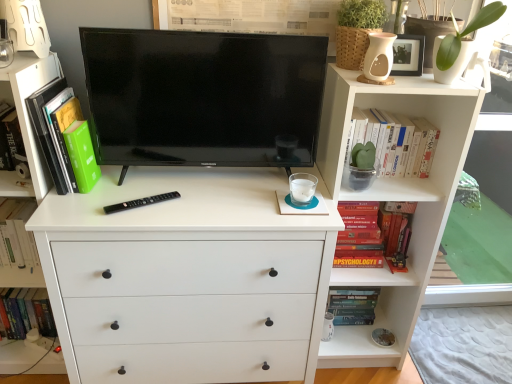
The image size is (512, 384). Identify the location of free space between green matte book at left, the second book viewed from the left, and black glossy tv at center. (165, 192).